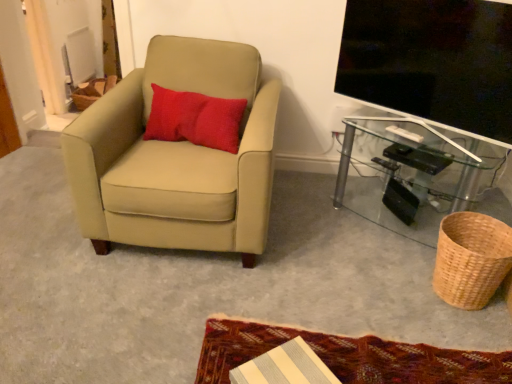
What are the coordinates of `vacant area that is in front of suede beige armchair at left` in the screenshot? It's located at (148, 306).